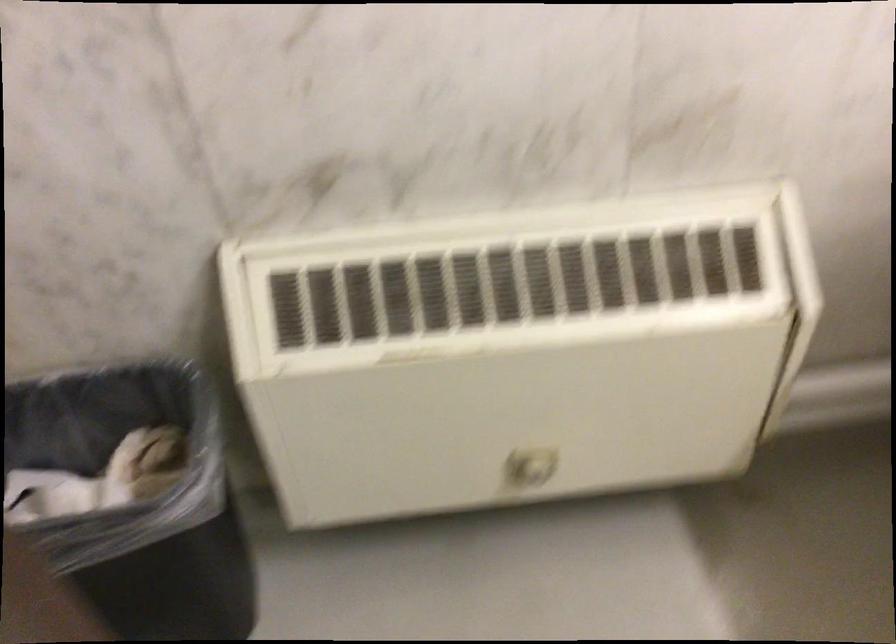
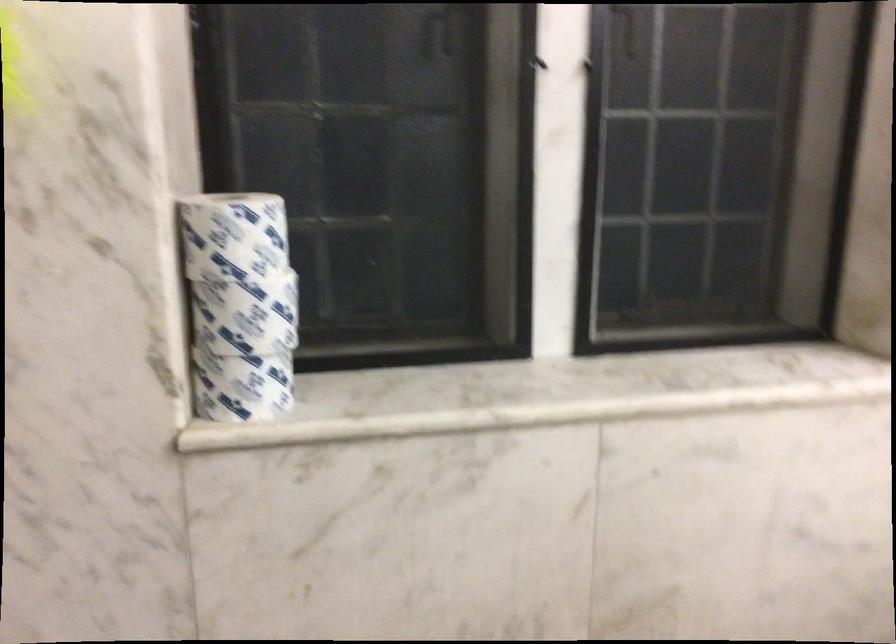
In the scene shown: What movement of the cameraman would produce the second image?

The cameraman walked toward left, backward.